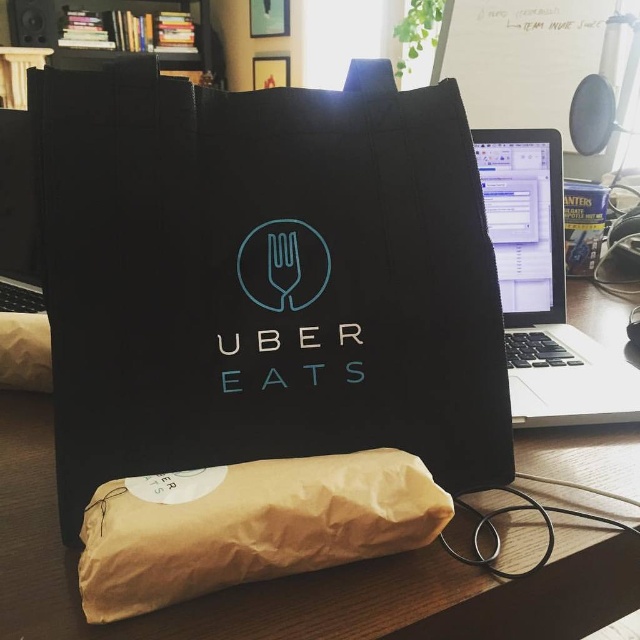
You are organizing items on a desk and need to place a new object near the black canvas tote bag at center. According to its coordinates, where exactly should you position the new object to be adjacent to the tote bag?

The black canvas tote bag at center is located at point (243,292), so positioning the new object near those coordinates would place it adjacent to the tote bag.

You are a delivery person who needs to pick up the teal plastic fork at center from the desk. The black matte bag at center is blocking your path. Can you move the black matte bag to access the fork?

The black matte bag at center is in front of the teal plastic fork at center, so you need to move the black matte bag at center to access the teal plastic fork at center.

You are a delivery person who needs to place a package on top of the black canvas tote bag at center and the black matte logo at center. Which object can you place the package on without it falling off?

The black canvas tote bag at center is bigger than the black matte logo at center, so you can place the package on the black canvas tote bag at center without it falling off.